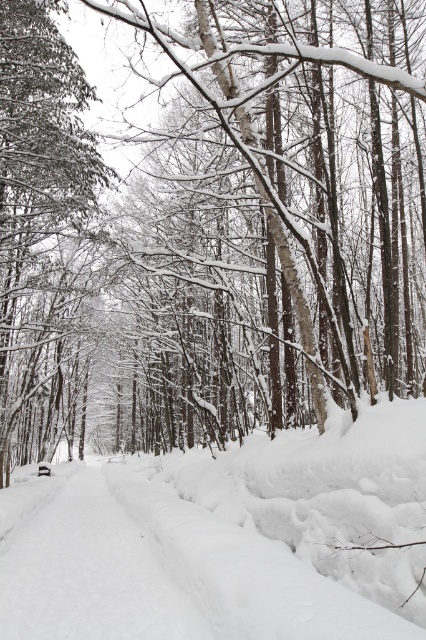
Can you confirm if white fluffy snow at center is bigger than green textured pine at left?

Actually, white fluffy snow at center might be smaller than green textured pine at left.

Can you confirm if white fluffy snow at center is thinner than green textured pine at left?

Indeed, white fluffy snow at center has a lesser width compared to green textured pine at left.

Find the location of `white fluffy snow at center`. white fluffy snow at center is located at coordinates (224, 538).